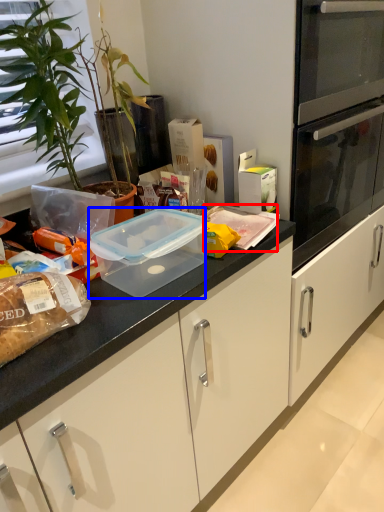
Question: Which object appears farthest to the camera in this image, food (highlighted by a red box) or appliance (highlighted by a blue box)?

Choices:
 (A) food
 (B) appliance

Answer: (A)